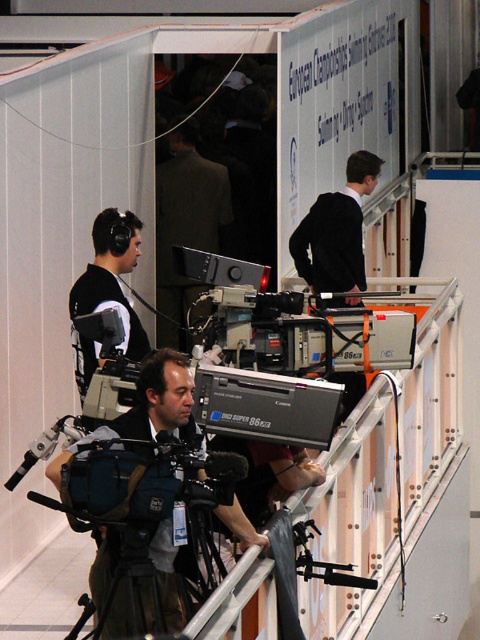
Question: Which object is the farthest from the dark gray suit at center?

Choices:
 (A) black matte headphones at left
 (B) matte black camera at center

Answer: (B)

Question: Does matte black camera at center have a greater width compared to black matte headphones at left?

Choices:
 (A) yes
 (B) no

Answer: (A)

Question: Is matte black camera at center further to camera compared to black matte headphones at left?

Choices:
 (A) yes
 (B) no

Answer: (B)

Question: Which of the following is the farthest from the observer?

Choices:
 (A) (167, 332)
 (B) (121, 627)
 (C) (73, 317)

Answer: (A)

Question: Is the position of dark gray suit at center less distant than that of black matte headphones at left?

Choices:
 (A) no
 (B) yes

Answer: (A)

Question: Which is nearer to the matte black camera at center?

Choices:
 (A) dark gray suit at center
 (B) black matte headphones at left

Answer: (B)